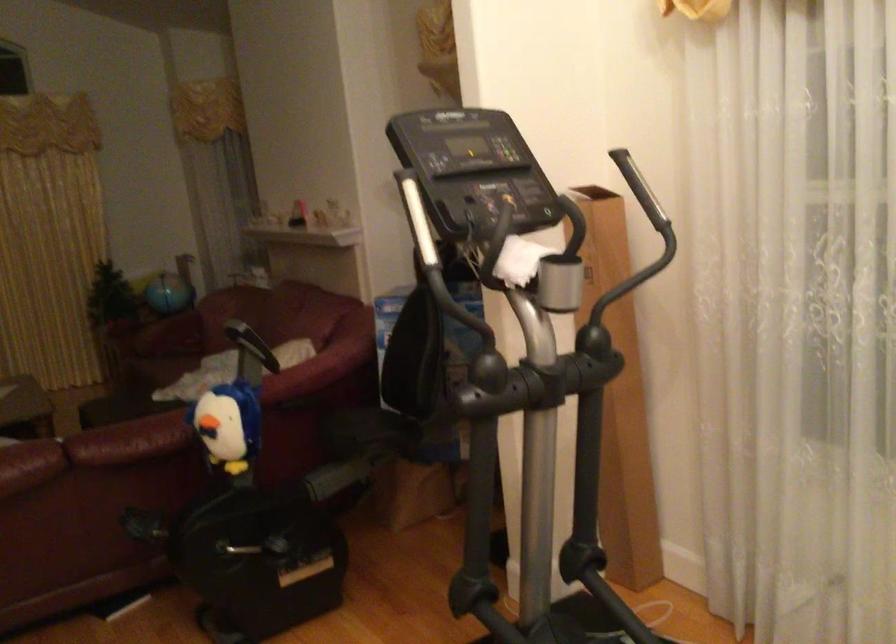
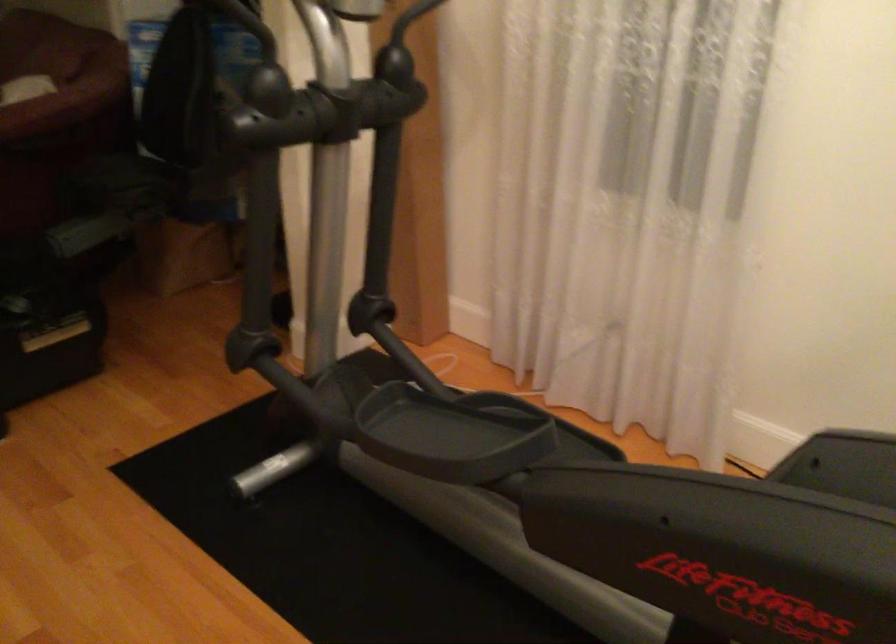
Which direction would the cameraman need to move to produce the second image?

The movement direction of the cameraman is left, forward.